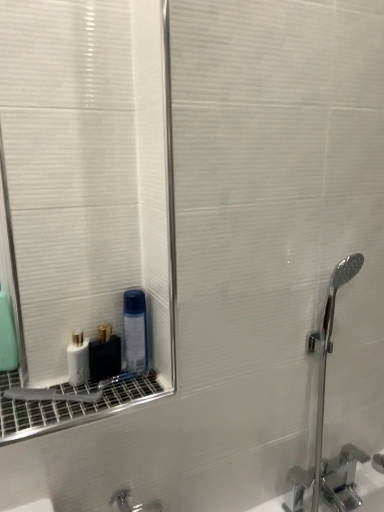
Question: In terms of width, does white glossy bottle at lower left, which is the second mouthwash from right to left, look wider or thinner when compared to transparent plastic mouthwash at lower left, the first mouthwash from the right?

Choices:
 (A) wide
 (B) thin

Answer: (B)

Question: Is white glossy bottle at lower left, which appears as the 3th mouthwash when viewed from the left, in front of or behind transparent plastic mouthwash at lower left, the first mouthwash from the right, in the image?

Choices:
 (A) behind
 (B) front

Answer: (B)

Question: Which of these objects is positioned closest to the transparent plastic mouthwash at lower left, the first mouthwash from the right?

Choices:
 (A) white glossy bottle at lower left, which appears as the 3th mouthwash when viewed from the left
 (B) chrome metallic faucet at right
 (C) white glossy bottle at lower left, placed as the third mouthwash when sorted from right to left
 (D) green matte mouthwash at left, arranged as the 4th mouthwash when viewed from the right

Answer: (A)

Question: Considering the real-world distances, which object is farthest from the white glossy bottle at lower left, placed as the third mouthwash when sorted from right to left?

Choices:
 (A) white glossy bottle at lower left, which appears as the 3th mouthwash when viewed from the left
 (B) chrome metallic faucet at right
 (C) green matte mouthwash at left, the 1th mouthwash viewed from the left
 (D) transparent plastic mouthwash at lower left, which ranks as the fourth mouthwash in left-to-right order

Answer: (B)